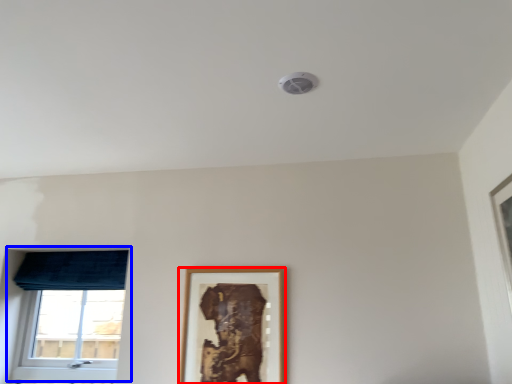
Question: Which point is further to the camera, picture frame (highlighted by a red box) or window (highlighted by a blue box)?

Choices:
 (A) picture frame
 (B) window

Answer: (B)